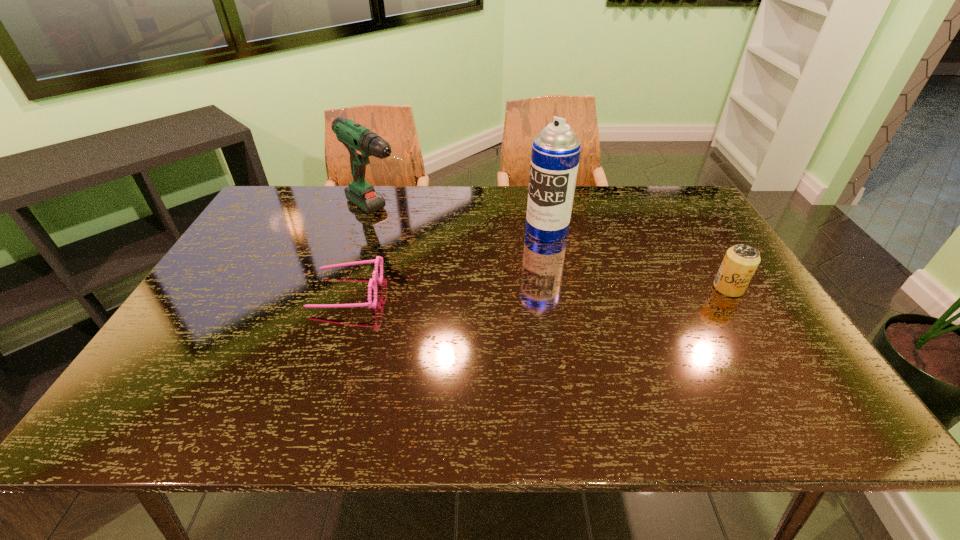
Locate an element on the screen. vacant area that lies between the shortest object and the drill is located at coordinates (363, 253).

Image resolution: width=960 pixels, height=540 pixels. What are the coordinates of `vacant space that's between the shortest object and the second object from right to left` in the screenshot? It's located at (446, 261).

You are a GUI agent. You are given a task and a screenshot of the screen. Output one action in this format:
    pyautogui.click(x=<x>, y=<y>)
    Task: Click on the blank region between the rightmost object and the drill
    The width and height of the screenshot is (960, 540).
    Given the screenshot: What is the action you would take?
    pyautogui.click(x=554, y=251)

The width and height of the screenshot is (960, 540). What are the coordinates of `empty space that is in between the rightmost object and the spectacles` in the screenshot? It's located at (538, 290).

What are the coordinates of `free space between the tallest object and the drill` in the screenshot? It's located at (463, 222).

This screenshot has height=540, width=960. In order to click on object identified as the second closest to the beer can in this screenshot , I will do `click(361, 143)`.

Select which object is the second closest to the beer can. Please provide its 2D coordinates. Your answer should be formatted as a tuple, i.e. [(x, y)], where the tuple contains the x and y coordinates of a point satisfying the conditions above.

[(361, 143)]

The image size is (960, 540). I want to click on free space that satisfies the following two spatial constraints: 1. on the front side of the third tallest object; 2. on the left side of the tallest object, so click(558, 288).

What are the coordinates of `vacant area in the image that satisfies the following two spatial constraints: 1. on the front side of the second tallest object; 2. on the left side of the aerosol can` in the screenshot? It's located at (373, 231).

Find the location of `free point that satisfies the following two spatial constraints: 1. on the front side of the rightmost object; 2. on the left side of the aerosol can`. free point that satisfies the following two spatial constraints: 1. on the front side of the rightmost object; 2. on the left side of the aerosol can is located at coordinates (558, 288).